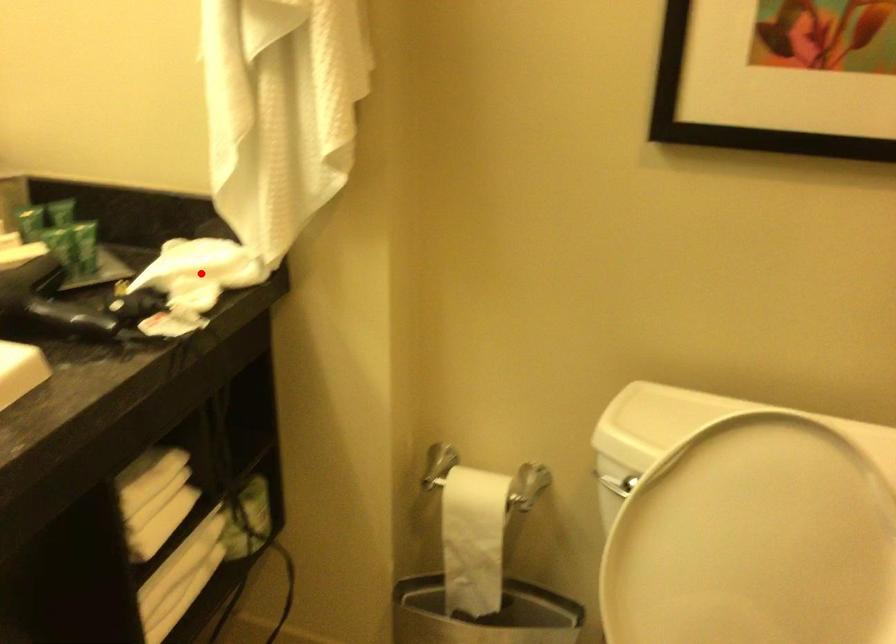
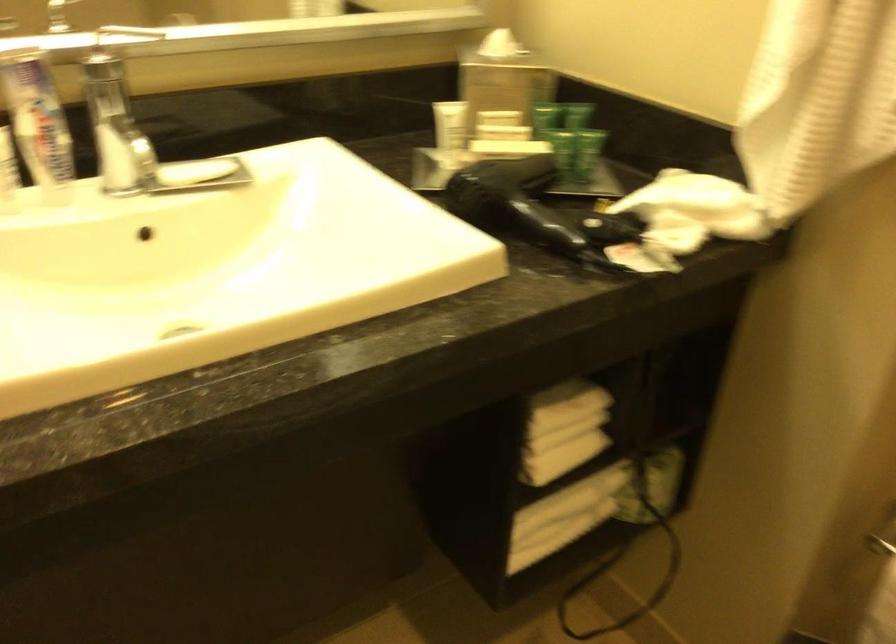
Question: I am providing you with two images of the same scene from different viewpoints. In image1, a red point is highlighted. Considering the same 3D point in image2, which of the following is correct?

Choices:
 (A) It is closer
 (B) It is farther

Answer: (A)